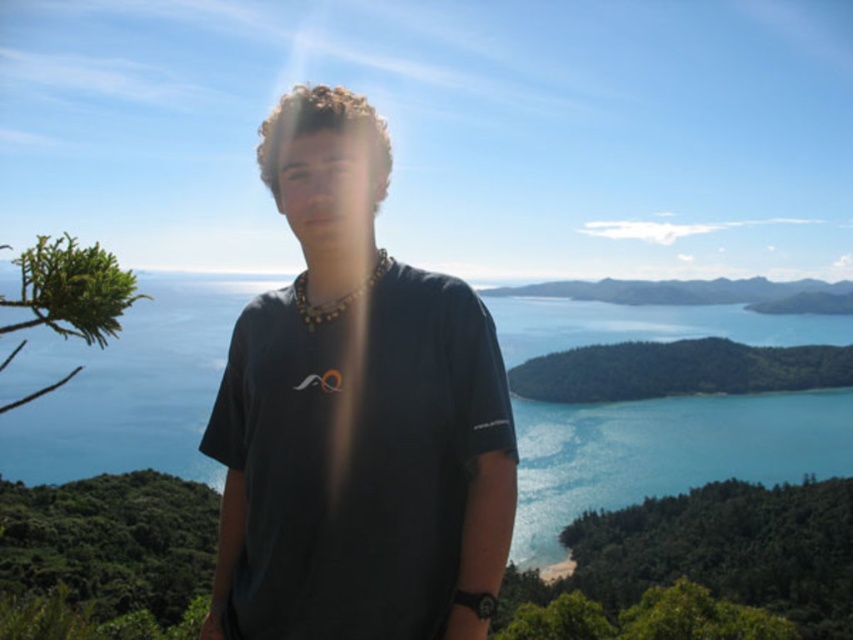
Question: Which point is farther to the camera?

Choices:
 (A) blue liquid water at center
 (B) dark blue t-shirt at center

Answer: (B)

Question: Which object is farther from the camera taking this photo?

Choices:
 (A) blue liquid water at center
 (B) dark blue t-shirt at center

Answer: (B)

Question: Does dark blue t-shirt at center appear on the left side of blue liquid water at center?

Choices:
 (A) no
 (B) yes

Answer: (B)

Question: Where is dark blue t-shirt at center located in relation to blue liquid water at center in the image?

Choices:
 (A) left
 (B) right

Answer: (A)

Question: Is dark blue t-shirt at center to the right of blue liquid water at center from the viewer's perspective?

Choices:
 (A) yes
 (B) no

Answer: (B)

Question: Which of the following is the closest to the observer?

Choices:
 (A) (80, 392)
 (B) (314, 152)

Answer: (B)